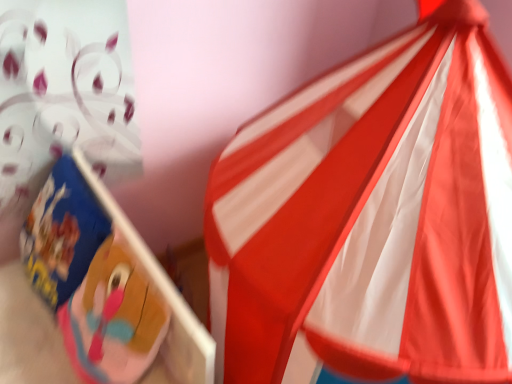
Identify the location of red/white striped tent at upper right. Image resolution: width=512 pixels, height=384 pixels. (372, 219).

Measure the distance between red/white striped tent at upper right and camera.

red/white striped tent at upper right and camera are 28.95 inches apart.

What do you see at coordinates (372, 219) in the screenshot? The image size is (512, 384). I see `red/white striped tent at upper right` at bounding box center [372, 219].

Where is `blue cardboard box at left`? blue cardboard box at left is located at coordinates (x=93, y=295).

What do you see at coordinates (93, 295) in the screenshot? I see `blue cardboard box at left` at bounding box center [93, 295].

Locate an element on the screen. The height and width of the screenshot is (384, 512). red/white striped tent at upper right is located at coordinates (372, 219).

Which is more to the right, blue cardboard box at left or red/white striped tent at upper right?

red/white striped tent at upper right is more to the right.

Between blue cardboard box at left and red/white striped tent at upper right, which one is positioned in front?

red/white striped tent at upper right is closer to the camera.

Which is in front, point (120, 234) or point (405, 219)?

Point (405, 219)

From the image's perspective, between blue cardboard box at left and red/white striped tent at upper right, who is located below?

blue cardboard box at left is shown below in the image.

From a real-world perspective, is blue cardboard box at left physically located above or below red/white striped tent at upper right?

blue cardboard box at left is situated lower than red/white striped tent at upper right in the real world.

In the scene shown: Which of these two, blue cardboard box at left or red/white striped tent at upper right, is thinner?

Thinner between the two is blue cardboard box at left.

Considering the relative sizes of blue cardboard box at left and red/white striped tent at upper right in the image provided, is blue cardboard box at left taller than red/white striped tent at upper right?

Incorrect, the height of blue cardboard box at left is not larger of that of red/white striped tent at upper right.

Does blue cardboard box at left have a smaller size compared to red/white striped tent at upper right?

Yes, blue cardboard box at left is smaller than red/white striped tent at upper right.

Is blue cardboard box at left located outside red/white striped tent at upper right?

Yes, blue cardboard box at left is located beyond the bounds of red/white striped tent at upper right.

Is blue cardboard box at left positioned far away from red/white striped tent at upper right?

blue cardboard box at left is actually quite close to red/white striped tent at upper right.

Is blue cardboard box at left facing towards red/white striped tent at upper right?

No.

What's the angular difference between blue cardboard box at left and red/white striped tent at upper right's facing directions?

50.3 degrees.

Image resolution: width=512 pixels, height=384 pixels. Find the location of `cardboard box on the left of red/white striped tent at upper right`. cardboard box on the left of red/white striped tent at upper right is located at coordinates (93, 295).

Looking at this image, which object is positioned more to the left, red/white striped tent at upper right or blue cardboard box at left?

blue cardboard box at left is more to the left.

Based on the photo, considering the positions of objects red/white striped tent at upper right and blue cardboard box at left in the image provided, who is in front, red/white striped tent at upper right or blue cardboard box at left?

red/white striped tent at upper right is in front.

Is point (391, 258) positioned behind point (202, 340)?

That is False.

From the image's perspective, relative to blue cardboard box at left, is red/white striped tent at upper right above or below?

Based on their image positions, red/white striped tent at upper right is located above blue cardboard box at left.

From a real-world perspective, is red/white striped tent at upper right physically located above or below blue cardboard box at left?

In terms of real-world spatial position, red/white striped tent at upper right is above blue cardboard box at left.

Is red/white striped tent at upper right wider or thinner than blue cardboard box at left?

Considering their sizes, red/white striped tent at upper right looks broader than blue cardboard box at left.

Considering the relative sizes of red/white striped tent at upper right and blue cardboard box at left in the image provided, is red/white striped tent at upper right shorter than blue cardboard box at left?

No.

In terms of size, does red/white striped tent at upper right appear bigger or smaller than blue cardboard box at left?

red/white striped tent at upper right is bigger than blue cardboard box at left.

Is red/white striped tent at upper right not within blue cardboard box at left?

red/white striped tent at upper right lies outside blue cardboard box at left's area.

Is red/white striped tent at upper right not close to blue cardboard box at left?

red/white striped tent at upper right is near blue cardboard box at left, not far away.

Is blue cardboard box at left at the back of red/white striped tent at upper right?

No, blue cardboard box at left is not at the back of red/white striped tent at upper right.

How different are the orientations of red/white striped tent at upper right and blue cardboard box at left in degrees?

50.3 degrees separate the facing orientations of red/white striped tent at upper right and blue cardboard box at left.

Image resolution: width=512 pixels, height=384 pixels. Identify the location of flag to the right of blue cardboard box at left. (372, 219).

This screenshot has width=512, height=384. Identify the location of flag located in front of the blue cardboard box at left. (372, 219).

Find the location of `flag located above the blue cardboard box at left (from a real-world perspective)`. flag located above the blue cardboard box at left (from a real-world perspective) is located at coordinates (372, 219).